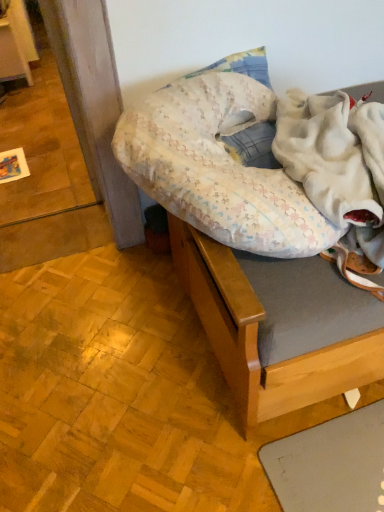
What do you see at coordinates (250, 246) in the screenshot? The width and height of the screenshot is (384, 512). I see `wooden hospital bed at center` at bounding box center [250, 246].

What is the approximate width of wooden hospital bed at center?

wooden hospital bed at center is 33.89 inches wide.

Measure the distance between point (x=281, y=329) and camera.

31.42 inches.

You are a GUI agent. You are given a task and a screenshot of the screen. Output one action in this format:
    pyautogui.click(x=<x>, y=<y>)
    Task: Click on the wooden hospital bed at center
    
    Given the screenshot: What is the action you would take?
    pyautogui.click(x=250, y=246)

Find the location of a particular element. The width and height of the screenshot is (384, 512). wooden hospital bed at center is located at coordinates (250, 246).